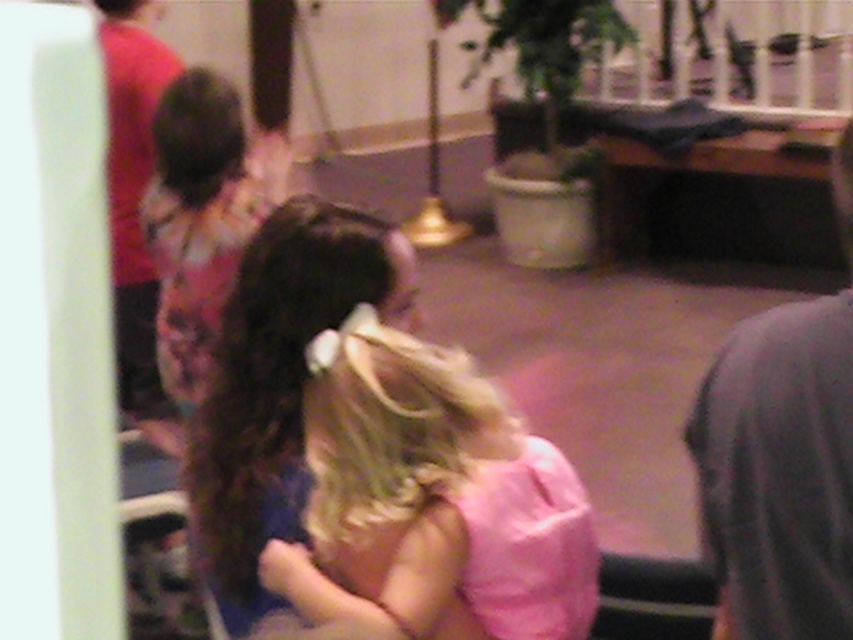
Between gray fabric shirt at right and dark brown hair at upper left, which one is positioned lower?

Positioned lower is gray fabric shirt at right.

Is gray fabric shirt at right below dark brown hair at upper left?

Yes, gray fabric shirt at right is below dark brown hair at upper left.

Between point (741, 420) and point (223, 120), which one is positioned in front?

Positioned in front is point (741, 420).

Find the location of `gray fabric shirt at right`. gray fabric shirt at right is located at coordinates pyautogui.click(x=779, y=472).

From the picture: Is dark brown silky hair at center thinner than red shirt at left?

Incorrect, dark brown silky hair at center's width is not less than red shirt at left's.

Which of these two, dark brown silky hair at center or red shirt at left, stands taller?

red shirt at left

Which is in front, point (357, 276) or point (142, 83)?

Point (357, 276) is more forward.

Where is `dark brown silky hair at center`? The image size is (853, 640). dark brown silky hair at center is located at coordinates [271, 388].

Does dark brown silky hair at center lie in front of dark brown silky hair at upper left?

Yes.

Is dark brown silky hair at center thinner than dark brown silky hair at upper left?

No.

Find the location of a particular element. The width and height of the screenshot is (853, 640). dark brown silky hair at center is located at coordinates (271, 388).